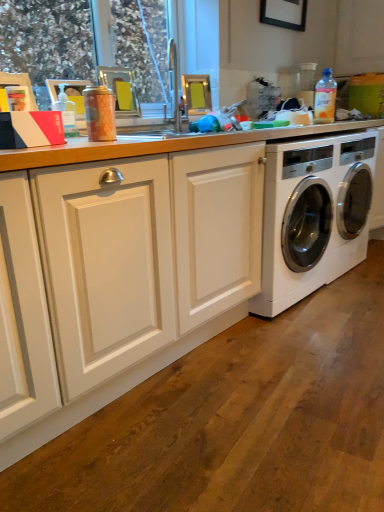
Question: Should I look upward or downward to see translucent plastic bottle at upper right, the 2th bottle positioned from the bottom?

Choices:
 (A) up
 (B) down

Answer: (A)

Question: From the image's perspective, would you say matte silver sink at upper center is shown under white glossy washing machine at right?

Choices:
 (A) yes
 (B) no

Answer: (B)

Question: Considering the relative sizes of matte silver sink at upper center and white glossy washing machine at right in the image provided, is matte silver sink at upper center smaller than white glossy washing machine at right?

Choices:
 (A) no
 (B) yes

Answer: (B)

Question: Is matte silver sink at upper center wider than white glossy washing machine at right?

Choices:
 (A) yes
 (B) no

Answer: (B)

Question: Can you confirm if matte silver sink at upper center is positioned to the right of white glossy washing machine at right?

Choices:
 (A) yes
 (B) no

Answer: (B)

Question: From a real-world perspective, does matte silver sink at upper center stand above white glossy washing machine at right?

Choices:
 (A) no
 (B) yes

Answer: (B)

Question: Is matte silver sink at upper center turned away from white glossy washing machine at right?

Choices:
 (A) yes
 (B) no

Answer: (B)

Question: Is transparent plastic window screen at upper left bigger than matte silver sink at upper center?

Choices:
 (A) yes
 (B) no

Answer: (A)

Question: Is the position of transparent plastic window screen at upper left less distant than that of matte silver sink at upper center?

Choices:
 (A) yes
 (B) no

Answer: (A)

Question: Could you tell me if transparent plastic window screen at upper left is turned towards matte silver sink at upper center?

Choices:
 (A) no
 (B) yes

Answer: (B)

Question: Considering the relative positions of transparent plastic window screen at upper left and matte silver sink at upper center in the image provided, is transparent plastic window screen at upper left to the left of matte silver sink at upper center from the viewer's perspective?

Choices:
 (A) no
 (B) yes

Answer: (B)

Question: From a real-world perspective, is transparent plastic window screen at upper left below matte silver sink at upper center?

Choices:
 (A) yes
 (B) no

Answer: (B)

Question: From the image's perspective, is transparent plastic window screen at upper left under matte silver sink at upper center?

Choices:
 (A) yes
 (B) no

Answer: (B)

Question: Is transparent plastic window screen at upper left outside transparent plastic bottle at upper left, arranged as the first bottle when ordered from the bottom?

Choices:
 (A) no
 (B) yes

Answer: (B)